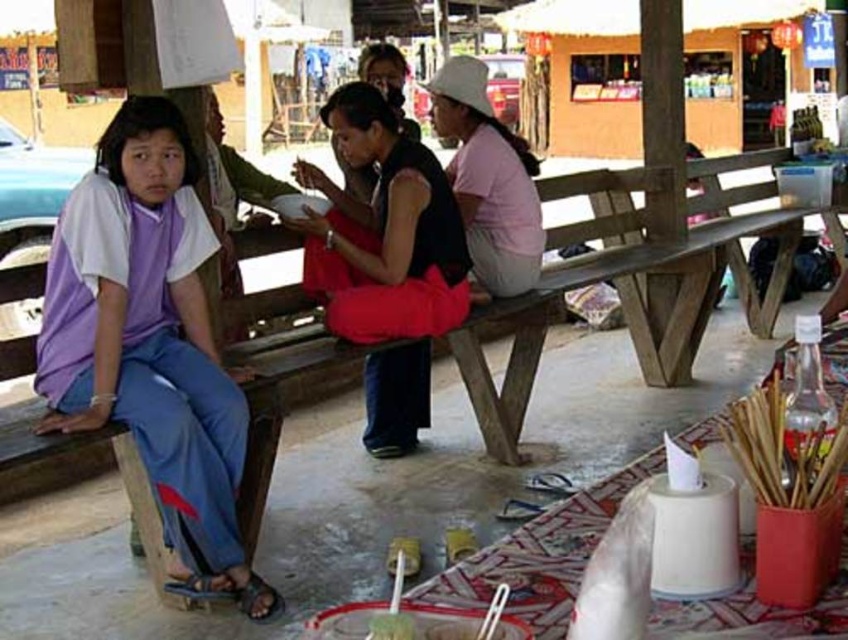
Based on the scene description, what are the coordinates of the purple cotton shirt at left?

The purple cotton shirt at left is located at coordinates (149, 340).